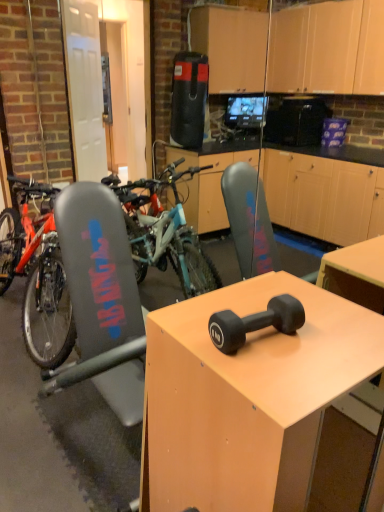
You are a GUI agent. You are given a task and a screenshot of the screen. Output one action in this format:
    pyautogui.click(x=<x>, y=<y>)
    Task: Click on the free spot in front of black rubber dumbbell at center
    This screenshot has height=512, width=384.
    Given the screenshot: What is the action you would take?
    pyautogui.click(x=275, y=378)